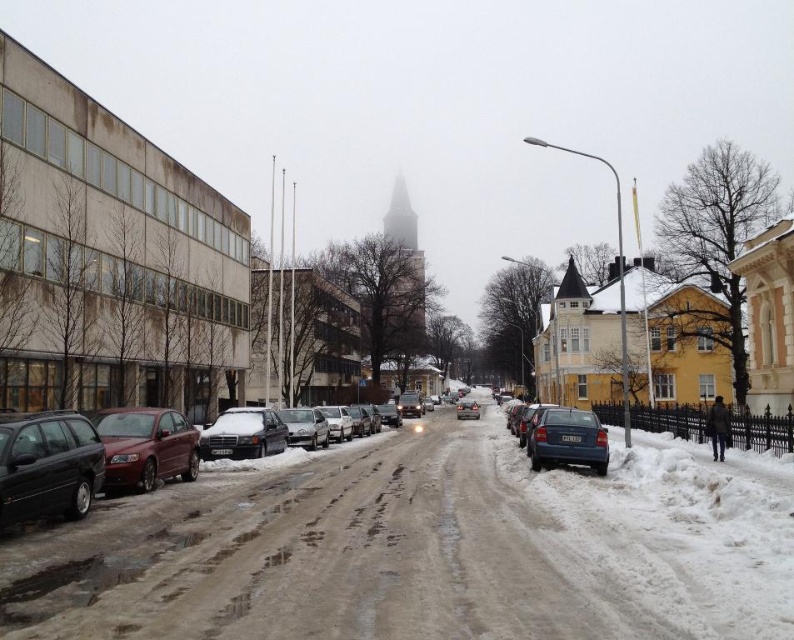
Who is higher up, white powdery snow at center or shiny black car at lower left?

Positioned higher is shiny black car at lower left.

Can you confirm if white powdery snow at center is taller than shiny black car at lower left?

Yes.

Who is more distant from viewer, (607, 506) or (75, 424)?

Positioned behind is point (607, 506).

Where is `white powdery snow at center`? This screenshot has height=640, width=794. white powdery snow at center is located at coordinates (422, 547).

Can you confirm if white powdery snow at center is shorter than matte black sedan at center?

Indeed, white powdery snow at center has a lesser height compared to matte black sedan at center.

Consider the image. Does white powdery snow at center come behind matte black sedan at center?

No, it is not.

The height and width of the screenshot is (640, 794). Identify the location of white powdery snow at center. (422, 547).

Does blue matte car at center-right appear on the left side of matte black sedan at center?

Correct, you'll find blue matte car at center-right to the left of matte black sedan at center.

Where is `blue matte car at center-right`? The width and height of the screenshot is (794, 640). blue matte car at center-right is located at coordinates (567, 440).

Where is `blue matte car at center-right`? The image size is (794, 640). blue matte car at center-right is located at coordinates (567, 440).